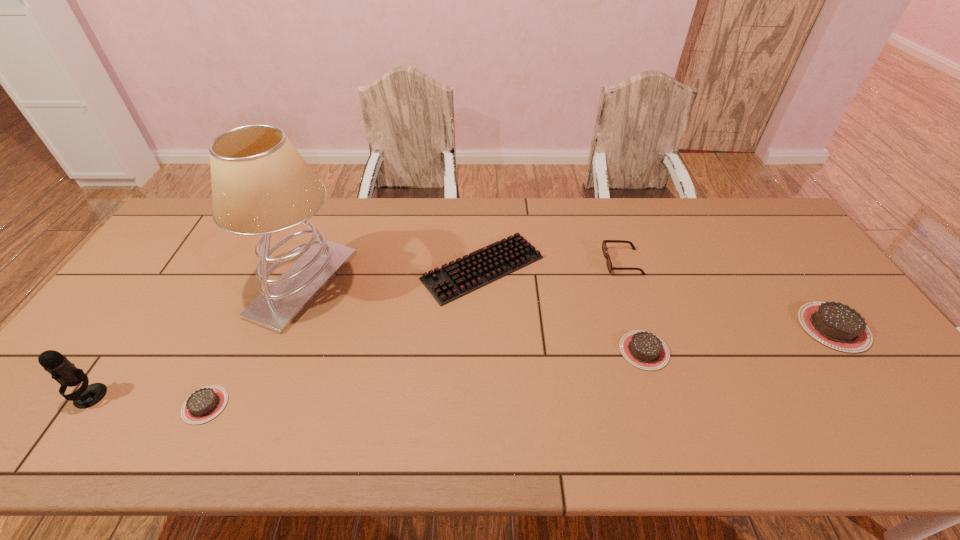
The width and height of the screenshot is (960, 540). What are the coordinates of `the nearest chocolate cake` in the screenshot? It's located at (204, 404).

Locate an element on the screen. The image size is (960, 540). the leftmost chocolate cake is located at coordinates (204, 404).

Find the location of a particular element. This screenshot has height=540, width=960. the fifth tallest object is located at coordinates (643, 349).

Where is `the second tallest chocolate cake`? Image resolution: width=960 pixels, height=540 pixels. the second tallest chocolate cake is located at coordinates (643, 349).

The image size is (960, 540). I want to click on the rightmost object, so [835, 325].

What are the coordinates of `the rightmost chocolate cake` in the screenshot? It's located at (835, 325).

Identify the location of the tallest object. (261, 185).

Image resolution: width=960 pixels, height=540 pixels. I want to click on sunglasses, so click(x=604, y=248).

Find the location of a particular element. This screenshot has width=960, height=540. the fourth object from left to right is located at coordinates (485, 265).

The height and width of the screenshot is (540, 960). I want to click on microphone, so click(x=62, y=370).